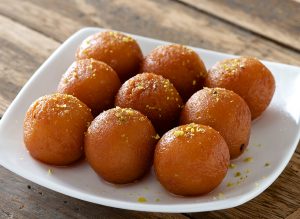
Locate an element on the screen. The height and width of the screenshot is (219, 300). table is located at coordinates (22, 41).